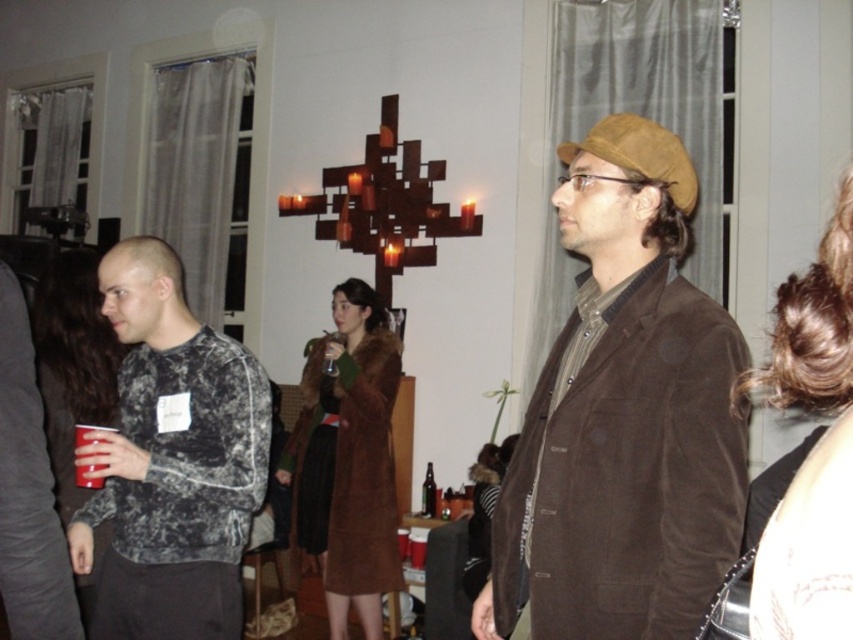
You are a bartender at the party and need to place a new order for drinks. You see the brown suede jacket at center and the matte plastic cup at lower left. Which object is bigger?

The brown suede jacket at center is larger in size than the matte plastic cup at lower left, so the brown suede jacket at center is bigger.

You are a bartender at the event and need to place a drink on the table between the brown suede jacket at center and the matte plastic cup at lower left. Which object should you position the drink closer to to ensure it doesn

The brown suede jacket at center is much taller than the matte plastic cup at lower left, so positioning the drink closer to the brown suede jacket at center would provide more stability due to its height.